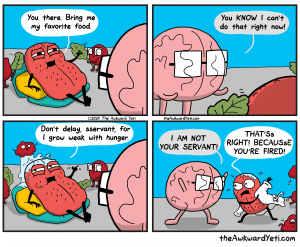
Where is `wall`? The width and height of the screenshot is (300, 247). wall is located at coordinates (14, 134).